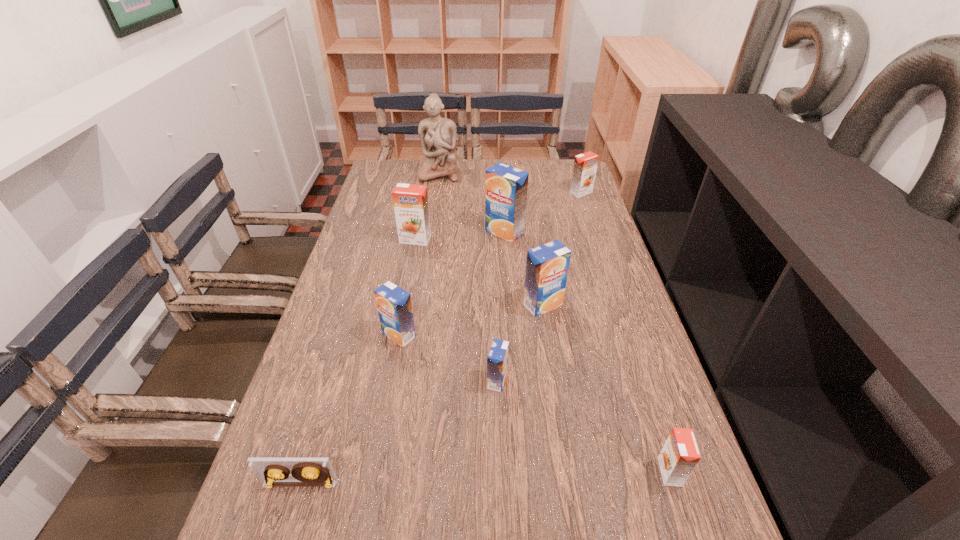
The height and width of the screenshot is (540, 960). I want to click on vacant area that lies between the biggest blue orange_juice and the second smallest blue orange_juice, so click(x=452, y=284).

This screenshot has height=540, width=960. I want to click on unoccupied position between the fifth farthest object and the smallest orange orange juice, so coord(607,388).

Locate an element on the screen. This screenshot has height=540, width=960. the third closest object to the nearest orange orange juice is located at coordinates (394, 306).

Image resolution: width=960 pixels, height=540 pixels. In order to click on the eighth closest object to the biggest blue orange_juice in this screenshot , I will do `click(271, 472)`.

Select which orange juice is the sixth closest to the nearest blue orange_juice. Please provide its 2D coordinates. Your answer should be formatted as a tuple, i.e. [(x, y)], where the tuple contains the x and y coordinates of a point satisfying the conditions above.

[(585, 165)]

In order to click on orange juice that is the sixth closest to the third nearest blue orange_juice in this screenshot , I will do `click(585, 165)`.

Locate which blue orange_juice is the second closest to the biggest blue orange_juice. Please provide its 2D coordinates. Your answer should be formatted as a tuple, i.e. [(x, y)], where the tuple contains the x and y coordinates of a point satisfying the conditions above.

[(394, 306)]

Point out which blue orange_juice is positioned as the nearest to the sixth farthest object. Please provide its 2D coordinates. Your answer should be formatted as a tuple, i.e. [(x, y)], where the tuple contains the x and y coordinates of a point satisfying the conditions above.

[(497, 361)]

Where is `the third closest orange orange juice to the second farthest blue orange_juice`? the third closest orange orange juice to the second farthest blue orange_juice is located at coordinates (585, 165).

At what (x,y) coordinates should I click in order to perform the action: click on orange orange juice that is the second nearest to the sixth farthest orange juice. Please return your answer as a coordinate pair (x, y). This screenshot has width=960, height=540. Looking at the image, I should click on (410, 201).